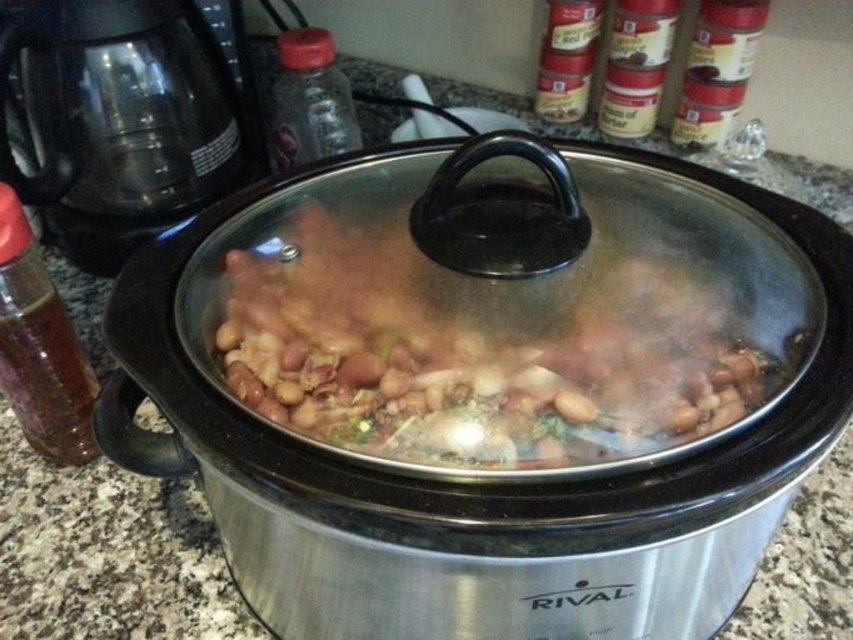
Looking at this image, does brown matte beans at center appear on the right side of translucent glass bottle at left?

Yes, brown matte beans at center is to the right of translucent glass bottle at left.

Image resolution: width=853 pixels, height=640 pixels. Identify the location of brown matte beans at center. click(476, 355).

Which is behind, point (409, 144) or point (276, 92)?

The point (276, 92) is behind.

The height and width of the screenshot is (640, 853). I want to click on stainless steel crock pot at center, so [x=485, y=477].

Is stainless steel crock pot at center to the left of brown matte beans at center from the viewer's perspective?

In fact, stainless steel crock pot at center is to the right of brown matte beans at center.

Locate an element on the screen. The height and width of the screenshot is (640, 853). stainless steel crock pot at center is located at coordinates (485, 477).